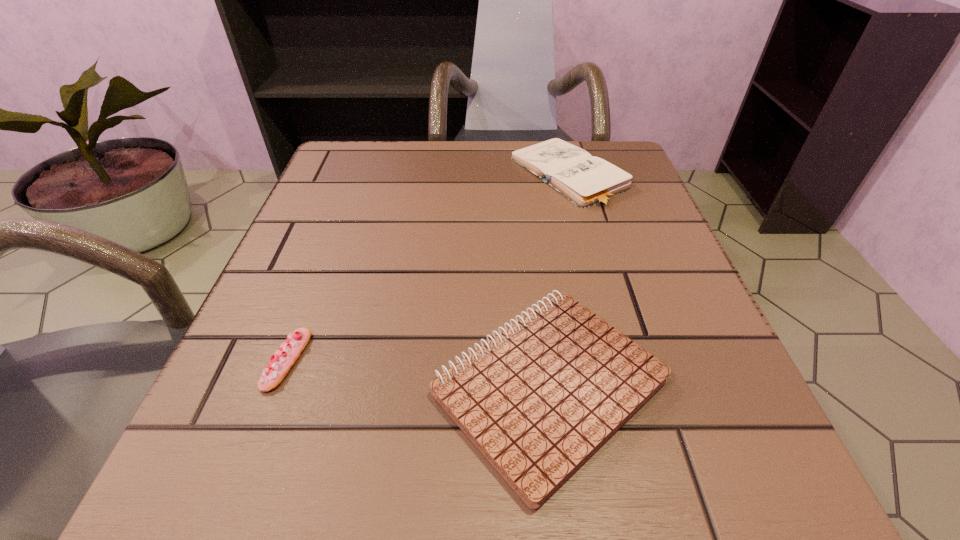
You are a GUI agent. You are given a task and a screenshot of the screen. Output one action in this format:
    pyautogui.click(x=<x>, y=<y>)
    Task: Click on the vacant space that satisfies the following two spatial constraints: 1. on the front side of the leftmost object; 2. on the right side of the nearer notebook
    The width and height of the screenshot is (960, 540).
    Given the screenshot: What is the action you would take?
    pyautogui.click(x=277, y=384)

The image size is (960, 540). Find the location of `vacant space that satisfies the following two spatial constraints: 1. on the front side of the leftmost object; 2. on the left side of the nearer notebook`. vacant space that satisfies the following two spatial constraints: 1. on the front side of the leftmost object; 2. on the left side of the nearer notebook is located at coordinates point(277,384).

I want to click on vacant space that satisfies the following two spatial constraints: 1. on the back side of the leftmost object; 2. on the left side of the farthest object, so click(357, 176).